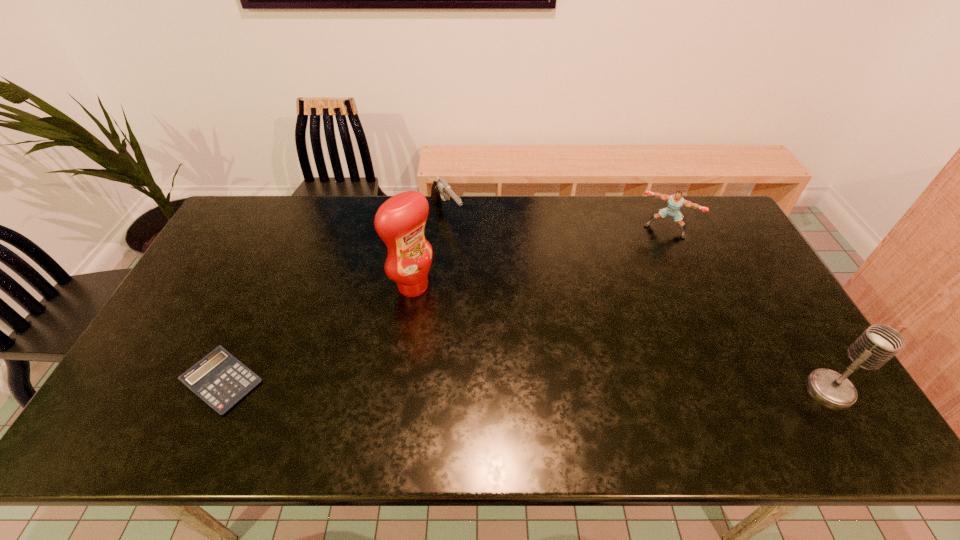
You are a GUI agent. You are given a task and a screenshot of the screen. Output one action in this format:
    pyautogui.click(x=<x>, y=<y>)
    Task: Click on the free space on the desktop that is between the shortest object and the second tallest object and is positioned on the front-facing side of the second object from right to left
    
    Given the screenshot: What is the action you would take?
    pyautogui.click(x=598, y=386)

Image resolution: width=960 pixels, height=540 pixels. In order to click on vacant space on the desktop that is between the leftmost object and the fourth shortest object and is positioned on the label side of the third farthest object in this screenshot , I will do `click(546, 386)`.

The image size is (960, 540). I want to click on vacant spot on the desktop that is between the leftmost object and the rightmost object and is positioned at the muzzle of the fourth tallest object, so click(x=602, y=386).